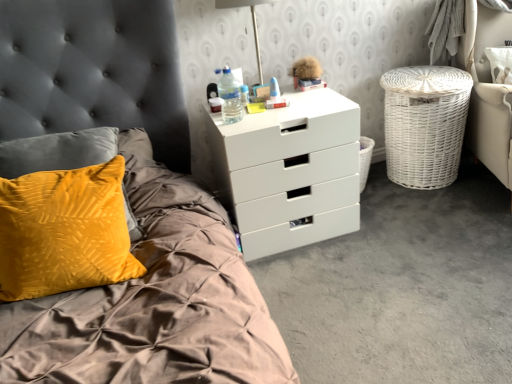
Identify the location of vacant space in front of translucent plastic water bottle at upper right. (237, 126).